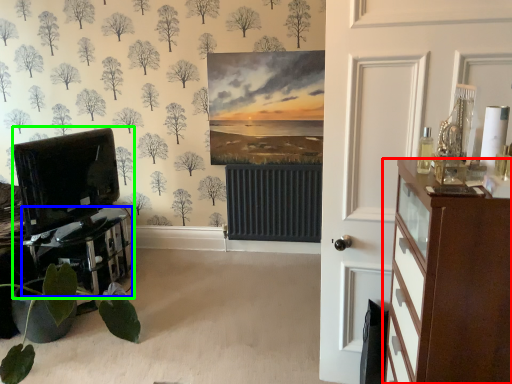
Question: Estimate the real-world distances between objects in this image. Which object is farther from chest of drawers (highlighted by a red box), table (highlighted by a blue box) or entertainment center (highlighted by a green box)?

Choices:
 (A) table
 (B) entertainment center

Answer: (B)